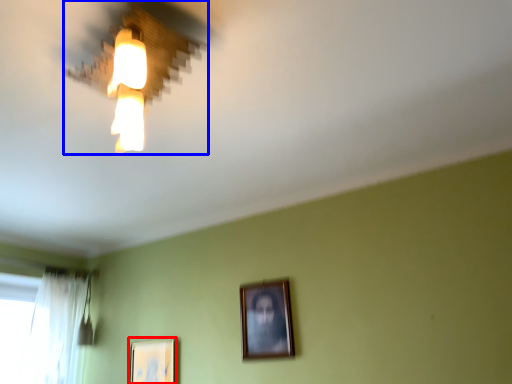
Question: Which of the following is the farthest to the observer, picture frame (highlighted by a red box) or lamp (highlighted by a blue box)?

Choices:
 (A) picture frame
 (B) lamp

Answer: (A)